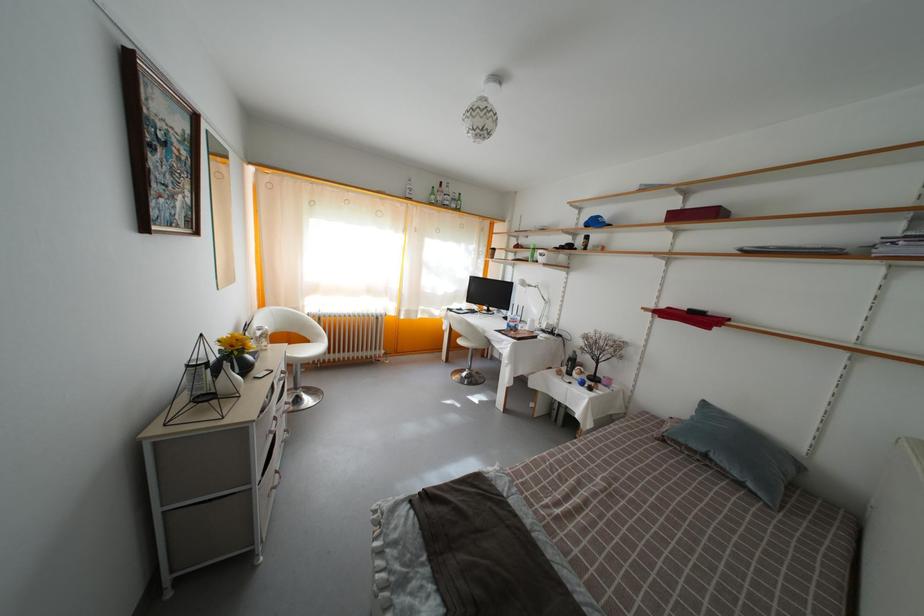
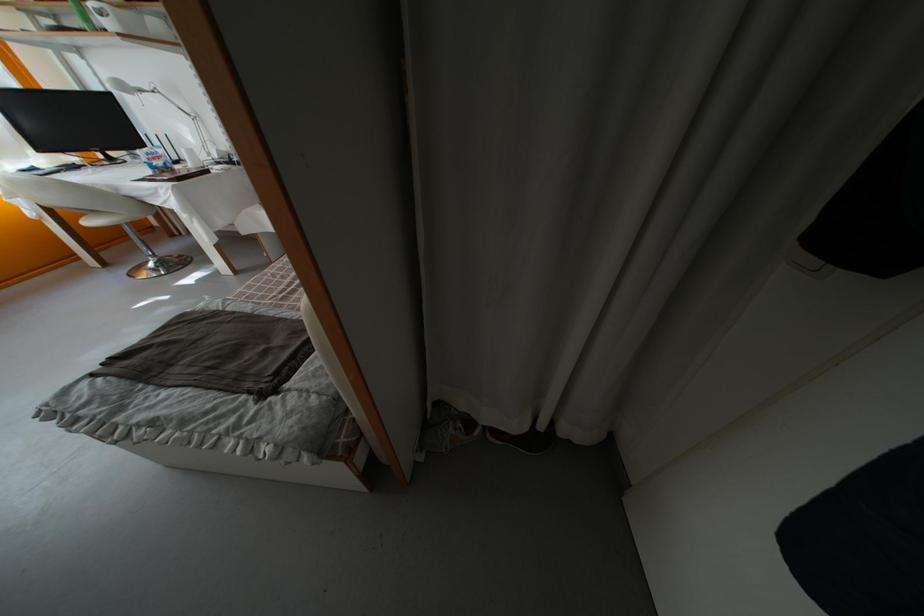
Locate, in the second image, the point that corresponds to [533,289] in the first image.

(139, 91)